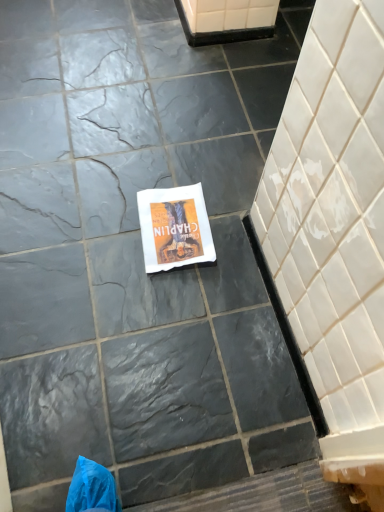
Locate an element on the screen. Image resolution: width=384 pixels, height=512 pixels. vacant space behind white paper towel at center is located at coordinates (172, 159).